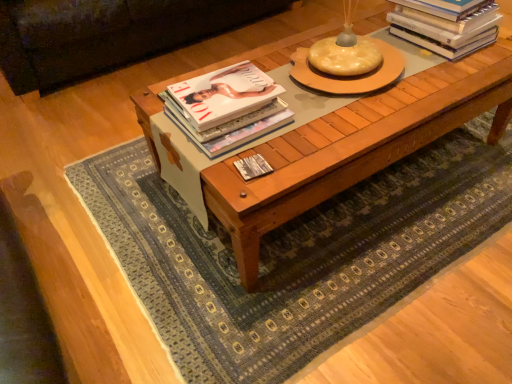
This screenshot has width=512, height=384. What are the coordinates of `vacant area in front of hardcover books at upper right, marked as the third book in a bottom-to-top arrangement` in the screenshot? It's located at (455, 73).